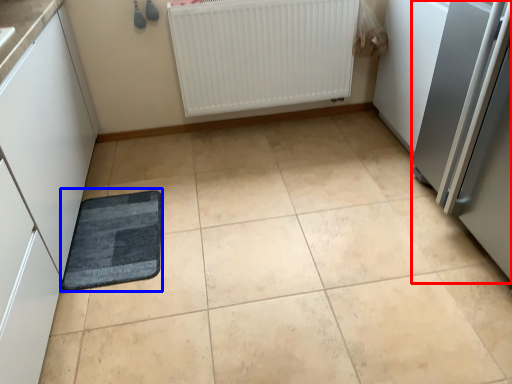
Question: Which object appears closest to the camera in this image, appliance (highlighted by a red box) or mat (highlighted by a blue box)?

Choices:
 (A) appliance
 (B) mat

Answer: (A)